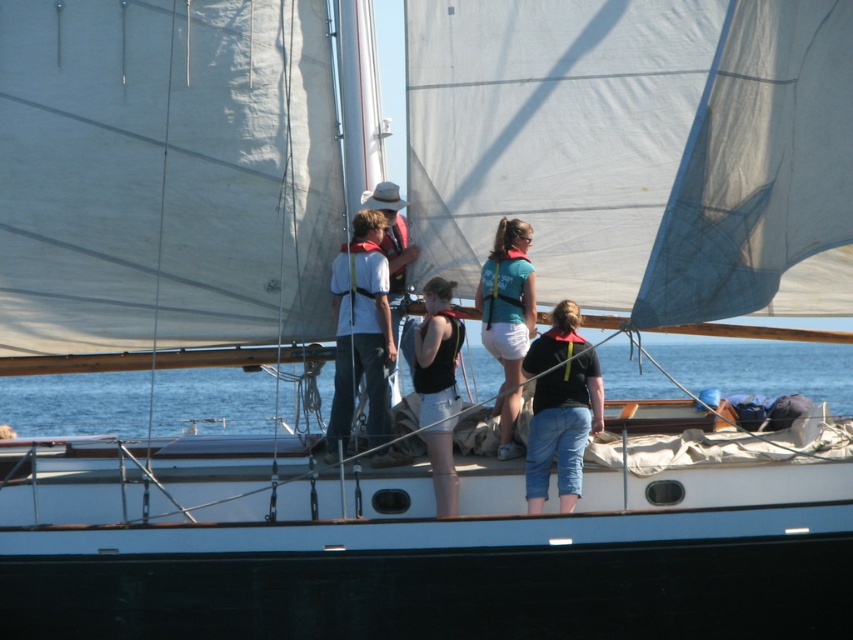
Question: Where is black fabric tank top at center located in relation to matte white life vest at center in the image?

Choices:
 (A) right
 (B) left

Answer: (A)

Question: Which object is farther from the camera taking this photo?

Choices:
 (A) black fabric tank top at center
 (B) blue water at center

Answer: (B)

Question: Among these points, which one is nearest to the camera?

Choices:
 (A) (439, 433)
 (B) (766, 380)
 (C) (572, 470)
 (D) (393, 291)

Answer: (C)

Question: Among these points, which one is farthest from the camera?

Choices:
 (A) (422, 385)
 (B) (514, 228)
 (C) (41, 412)

Answer: (C)

Question: Considering the relative positions of black fabric tank top at center and matte white life vest at center in the image provided, where is black fabric tank top at center located with respect to matte white life vest at center?

Choices:
 (A) below
 (B) above

Answer: (A)

Question: Where is matte black shirt at center located in relation to matte white life vest at center in the image?

Choices:
 (A) right
 (B) left

Answer: (A)